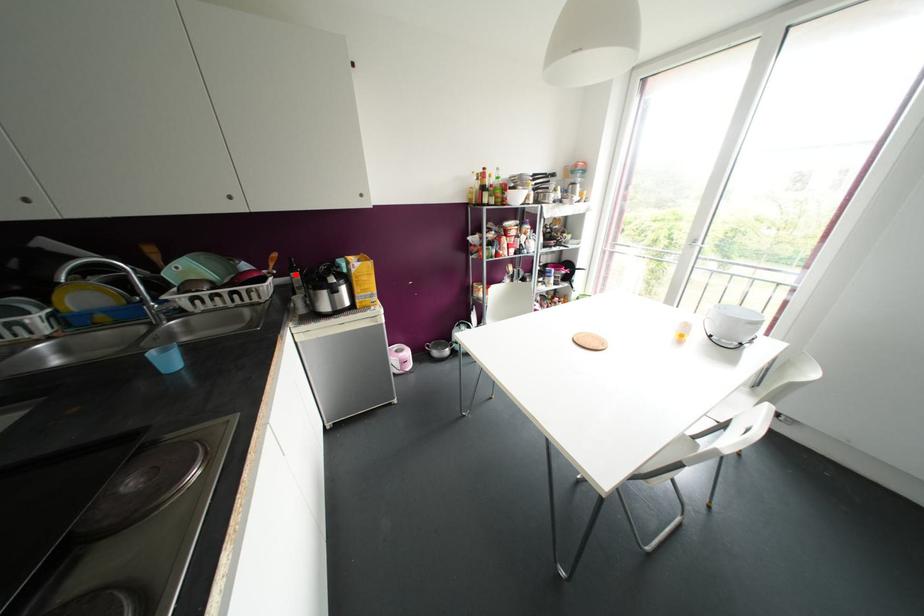
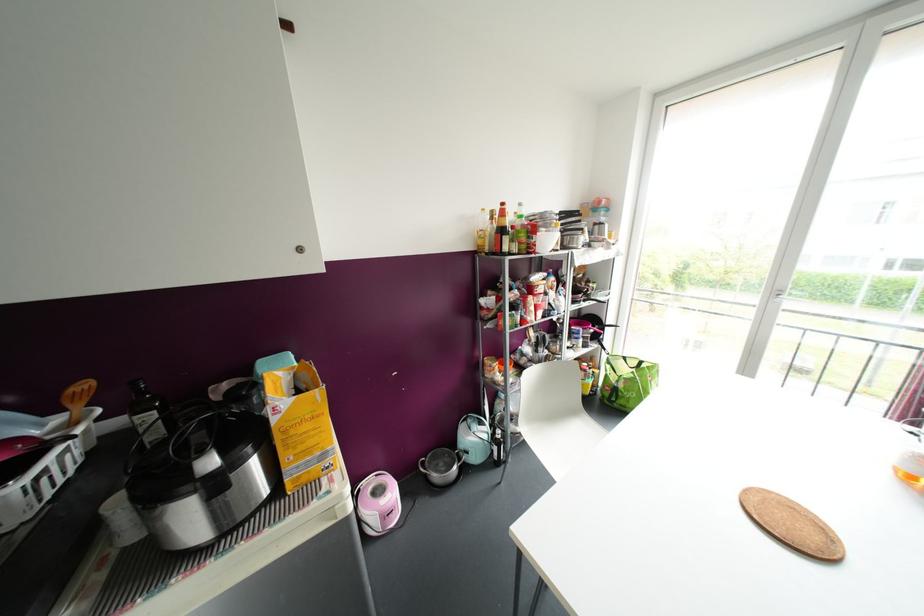
In the second image, find the point that corresponds to the highlighted location in the first image.

(150, 416)